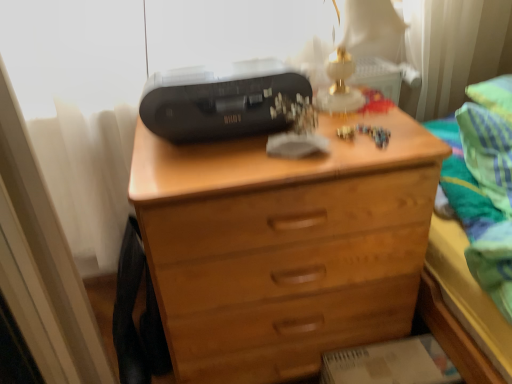
I want to click on blank space above wooden chest of drawers at center (from a real-world perspective), so click(x=294, y=144).